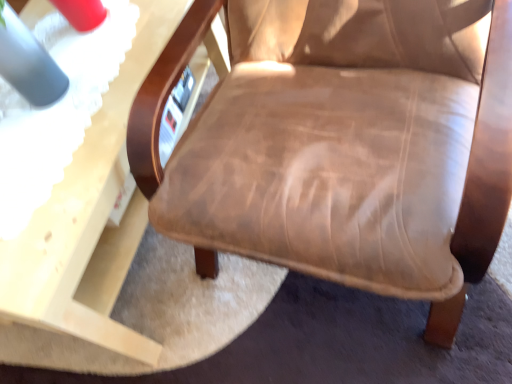
Question: Relative to matte wood table at lower left, is leather-like brown chair at center in front or behind?

Choices:
 (A) front
 (B) behind

Answer: (A)

Question: From the image's perspective, is leather-like brown chair at center above or below matte wood table at lower left?

Choices:
 (A) above
 (B) below

Answer: (A)

Question: Does point (258, 1) appear closer or farther from the camera than point (97, 259)?

Choices:
 (A) farther
 (B) closer

Answer: (B)

Question: Considering the positions of matte wood table at lower left and leather-like brown chair at center in the image, is matte wood table at lower left wider or thinner than leather-like brown chair at center?

Choices:
 (A) thin
 (B) wide

Answer: (B)

Question: Choose the correct answer: Is matte wood table at lower left inside leather-like brown chair at center or outside it?

Choices:
 (A) outside
 (B) inside

Answer: (A)

Question: Considering the positions of matte wood table at lower left and leather-like brown chair at center in the image, is matte wood table at lower left taller or shorter than leather-like brown chair at center?

Choices:
 (A) tall
 (B) short

Answer: (B)

Question: Is matte wood table at lower left to the left or to the right of leather-like brown chair at center in the image?

Choices:
 (A) right
 (B) left

Answer: (B)